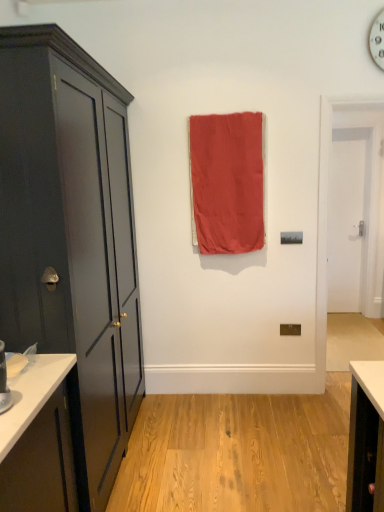
Question: Considering the positions of coral fabric curtain at center and white smooth door at right in the image, is coral fabric curtain at center bigger or smaller than white smooth door at right?

Choices:
 (A) big
 (B) small

Answer: (A)

Question: Based on their positions, is coral fabric curtain at center located to the left or right of white smooth door at right?

Choices:
 (A) left
 (B) right

Answer: (A)

Question: Which is nearer to the coral fabric curtain at center?

Choices:
 (A) white smooth door at right
 (B) matte dark gray cabinet at left

Answer: (B)

Question: Estimate the real-world distances between objects in this image. Which object is closer to the matte dark gray cabinet at left?

Choices:
 (A) white smooth door at right
 (B) coral fabric curtain at center

Answer: (B)